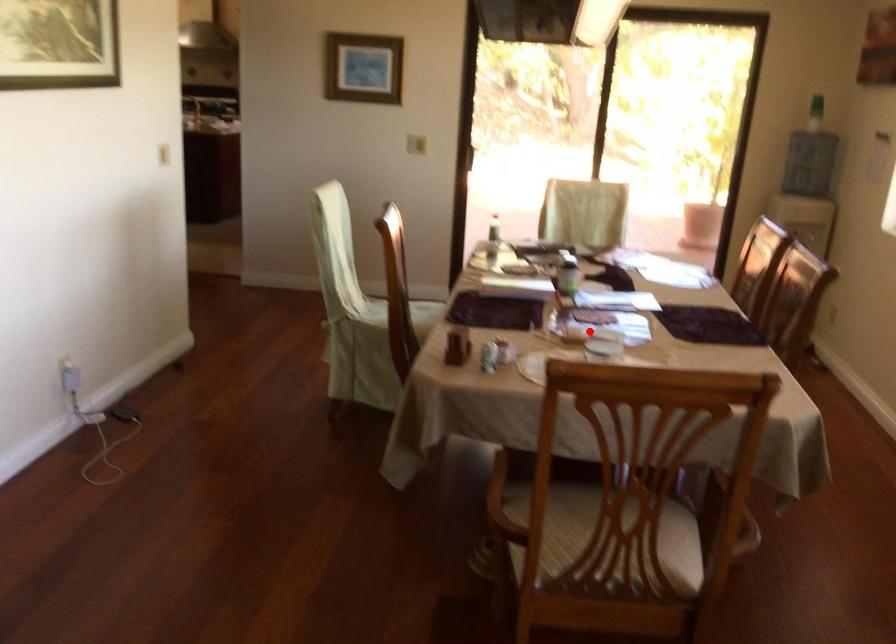
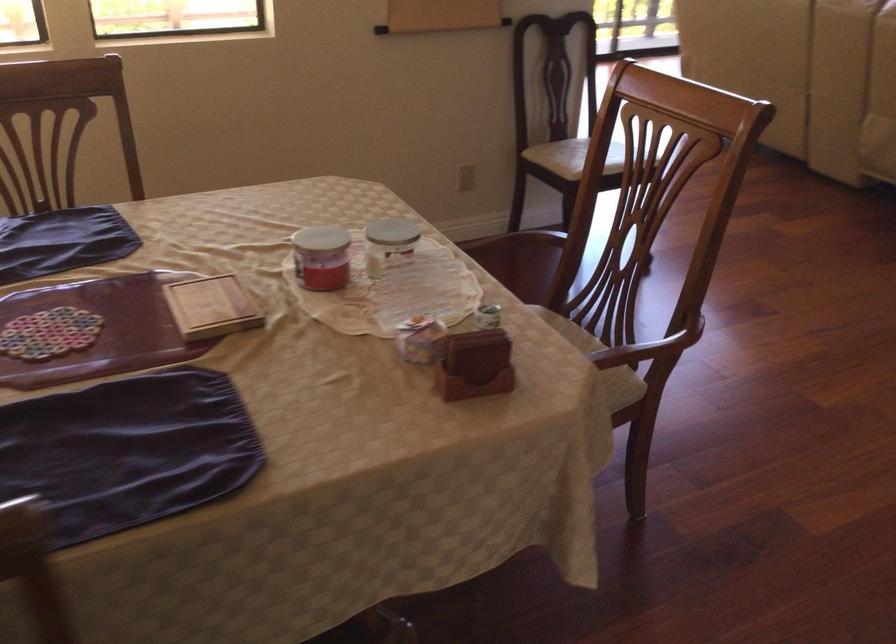
Where in the second image is the point corresponding to the highlighted location from the first image?

(211, 307)